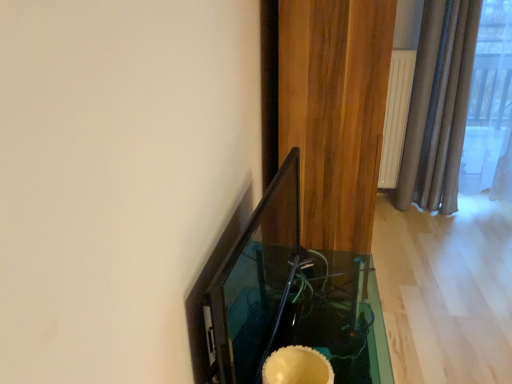
You are a GUI agent. You are given a task and a screenshot of the screen. Output one action in this format:
    pyautogui.click(x=<x>, y=<y>)
    Task: Click on the brown wood curtain at right
    
    Given the screenshot: What is the action you would take?
    pyautogui.click(x=335, y=112)

This screenshot has height=384, width=512. What do you see at coordinates (335, 112) in the screenshot? I see `brown wood curtain at right` at bounding box center [335, 112].

Where is `transparent glass table at center`? The width and height of the screenshot is (512, 384). transparent glass table at center is located at coordinates (339, 317).

What is the approximate height of transparent glass table at center?

transparent glass table at center is 39.44 centimeters tall.

The image size is (512, 384). Describe the element at coordinates (339, 317) in the screenshot. I see `transparent glass table at center` at that location.

You are a GUI agent. You are given a task and a screenshot of the screen. Output one action in this format:
    pyautogui.click(x=<x>, y=<y>)
    Task: Click on the brown wood curtain at right
    The height and width of the screenshot is (384, 512).
    Given the screenshot: What is the action you would take?
    pyautogui.click(x=335, y=112)

Considering the relative positions of brown wood curtain at right and transparent glass table at center in the image provided, is brown wood curtain at right to the left of transparent glass table at center from the viewer's perspective?

No.

Is brown wood curtain at right behind transparent glass table at center?

That is True.

Is point (333, 246) behind point (351, 319)?

Yes, it is behind point (351, 319).

From the image's perspective, which is below, brown wood curtain at right or transparent glass table at center?

From the image's view, transparent glass table at center is below.

From a real-world perspective, is brown wood curtain at right located beneath transparent glass table at center?

No, from a real-world perspective, brown wood curtain at right is not below transparent glass table at center.

Can you confirm if brown wood curtain at right is wider than transparent glass table at center?

Indeed, brown wood curtain at right has a greater width compared to transparent glass table at center.

From their relative heights in the image, would you say brown wood curtain at right is taller or shorter than transparent glass table at center?

In the image, brown wood curtain at right appears to be taller than transparent glass table at center.

Is brown wood curtain at right bigger than transparent glass table at center?

Yes, brown wood curtain at right is bigger than transparent glass table at center.

Choose the correct answer: Is brown wood curtain at right inside transparent glass table at center or outside it?

brown wood curtain at right is spatially situated outside transparent glass table at center.

Is brown wood curtain at right touching transparent glass table at center?

No, brown wood curtain at right is not next to transparent glass table at center.

Is brown wood curtain at right facing away from transparent glass table at center?

brown wood curtain at right does not have its back to transparent glass table at center.

Can you tell me how much brown wood curtain at right and transparent glass table at center differ in facing direction?

They differ by 0.656 degrees in their facing directions.

Where is `curtain located on the right of transparent glass table at center`? curtain located on the right of transparent glass table at center is located at coordinates (335, 112).

Is transparent glass table at center at the right side of brown wood curtain at right?

No, transparent glass table at center is not to the right of brown wood curtain at right.

Considering their positions, is transparent glass table at center located in front of or behind brown wood curtain at right?

Visually, transparent glass table at center is located in front of brown wood curtain at right.

Does point (316, 344) come in front of point (341, 197)?

That is True.

From the image's perspective, relative to brown wood curtain at right, is transparent glass table at center above or below?

From the image's perspective, transparent glass table at center appears below brown wood curtain at right.

From a real-world perspective, relative to brown wood curtain at right, is transparent glass table at center vertically above or below?

Clearly, from a real-world perspective, transparent glass table at center is below brown wood curtain at right.

Can you confirm if transparent glass table at center is thinner than brown wood curtain at right?

Indeed, transparent glass table at center has a lesser width compared to brown wood curtain at right.

Which of these two, transparent glass table at center or brown wood curtain at right, stands shorter?

With less height is transparent glass table at center.

Between transparent glass table at center and brown wood curtain at right, which one has larger size?

brown wood curtain at right is bigger.

Would you say transparent glass table at center is inside or outside brown wood curtain at right?

transparent glass table at center is spatially situated outside brown wood curtain at right.

Is transparent glass table at center in contact with brown wood curtain at right?

No, transparent glass table at center is not touching brown wood curtain at right.

Is brown wood curtain at right at the back of transparent glass table at center?

No, transparent glass table at center is not facing the opposite direction of brown wood curtain at right.

How many degrees apart are the facing directions of transparent glass table at center and brown wood curtain at right?

0.656 degrees.

Measure the distance from transparent glass table at center to brown wood curtain at right.

transparent glass table at center is 20.39 inches away from brown wood curtain at right.

Locate an element on the screen. table in front of the brown wood curtain at right is located at coordinates (339, 317).

What are the coordinates of `curtain above the transparent glass table at center (from the image's perspective)` in the screenshot? It's located at (335, 112).

Image resolution: width=512 pixels, height=384 pixels. In order to click on curtain that is behind the transparent glass table at center in this screenshot , I will do `click(335, 112)`.